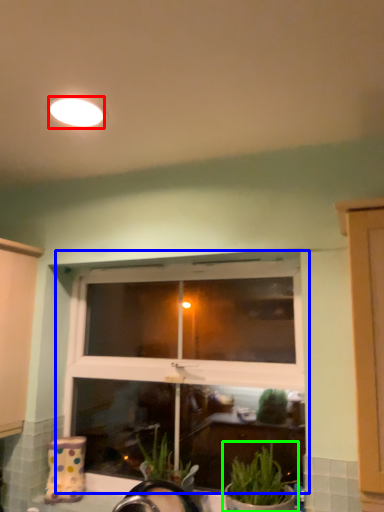
Question: Estimate the real-world distances between objects in this image. Which object is closer to lighting (highlighted by a red box), window (highlighted by a blue box) or houseplant (highlighted by a green box)?

Choices:
 (A) window
 (B) houseplant

Answer: (A)